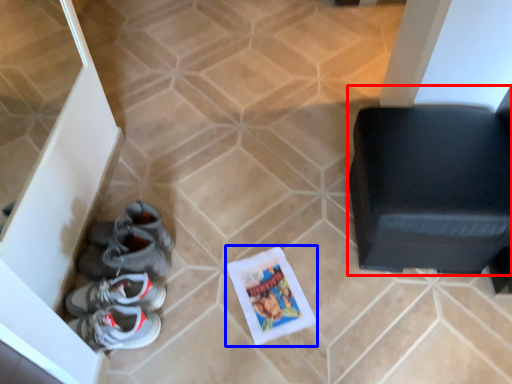
Question: Among these objects, which one is nearest to the camera, furniture (highlighted by a red box) or comic book (highlighted by a blue box)?

Choices:
 (A) furniture
 (B) comic book

Answer: (A)